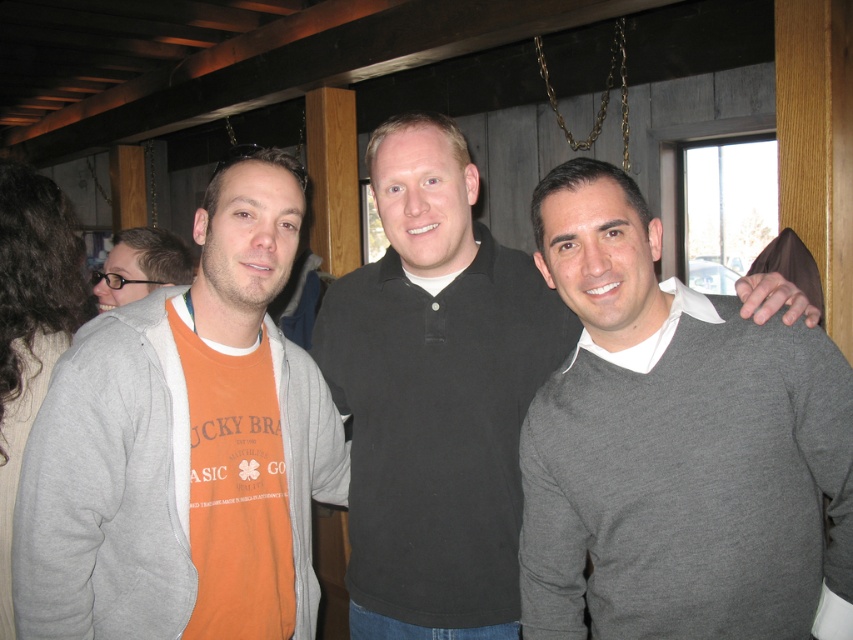
Question: Considering the real-world distances, which object is farthest from the matte orange t-shirt at left?

Choices:
 (A) orange cotton t-shirt at left
 (B) black smooth polo shirt at center

Answer: (A)

Question: Is orange cotton t-shirt at left below matte orange t-shirt at left?

Choices:
 (A) yes
 (B) no

Answer: (A)

Question: Which of the following is the closest to the observer?

Choices:
 (A) orange cotton t-shirt at left
 (B) black smooth polo shirt at center

Answer: (A)

Question: Can you confirm if orange cotton t-shirt at left is smaller than black smooth polo shirt at center?

Choices:
 (A) no
 (B) yes

Answer: (A)

Question: Which of the following is the farthest from the observer?

Choices:
 (A) black smooth polo shirt at center
 (B) orange cotton t-shirt at left

Answer: (A)

Question: Does orange cotton t-shirt at left appear under matte orange t-shirt at left?

Choices:
 (A) no
 (B) yes

Answer: (B)